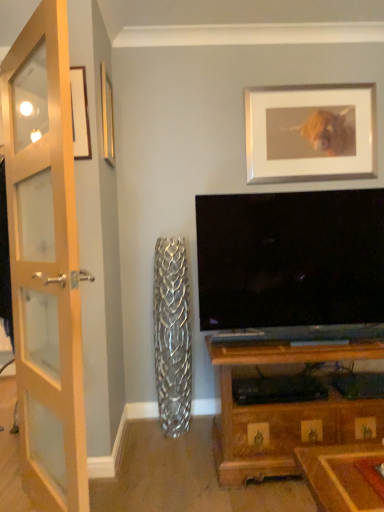
Question: Choose the correct answer: Is wooden picture frame at upper left, the second picture frame when ordered from back to front, inside silver/metallic picture frame at upper center, the 2th picture frame in the left-to-right sequence, or outside it?

Choices:
 (A) inside
 (B) outside

Answer: (B)

Question: Considering the positions of wooden picture frame at upper left, the second picture frame when ordered from back to front, and silver/metallic picture frame at upper center, the 2th picture frame viewed from the front, in the image, is wooden picture frame at upper left, the second picture frame when ordered from back to front, wider or thinner than silver/metallic picture frame at upper center, the 2th picture frame viewed from the front,?

Choices:
 (A) wide
 (B) thin

Answer: (B)

Question: Which object is the closest to the wooden glass door at left?

Choices:
 (A) silver/metallic picture frame at upper center, the 2th picture frame in the left-to-right sequence
 (B) wooden picture frame at upper left, placed as the second picture frame when sorted from right to left

Answer: (B)

Question: Estimate the real-world distances between objects in this image. Which object is farther from the wooden picture frame at upper left, which ranks as the first picture frame in left-to-right order?

Choices:
 (A) wooden glass door at left
 (B) silver/metallic picture frame at upper center, the 2th picture frame in the left-to-right sequence

Answer: (B)